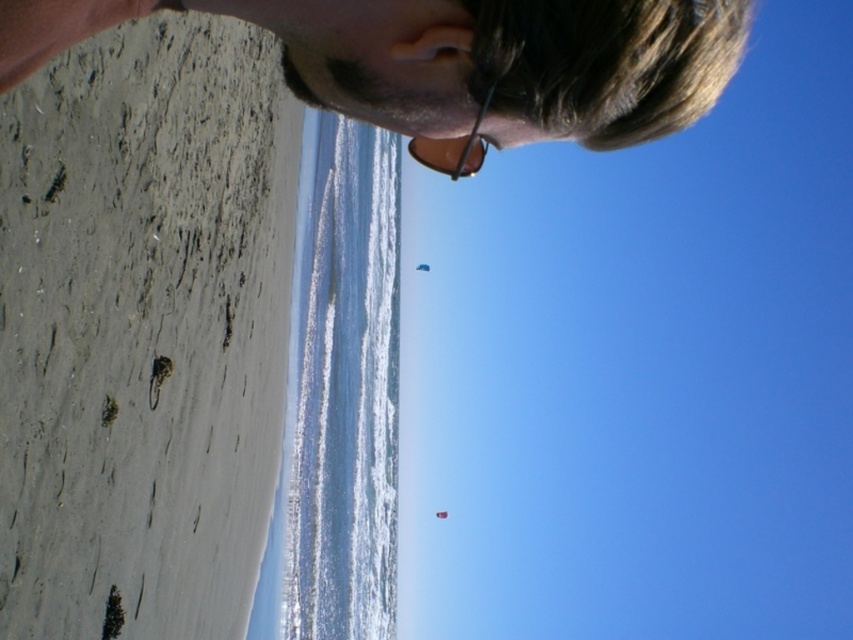
Who is positioned more to the right, sunglasses at upper center or blue fabric kite at center?

sunglasses at upper center

Which is below, sunglasses at upper center or blue fabric kite at center?

sunglasses at upper center

Find the location of `sunglasses at upper center`. sunglasses at upper center is located at coordinates (454, 147).

I want to click on sunglasses at upper center, so click(x=454, y=147).

Is smooth sand at lower left to the right of red fabric kite at upper center from the viewer's perspective?

Incorrect, smooth sand at lower left is not on the right side of red fabric kite at upper center.

Between smooth sand at lower left and red fabric kite at upper center, which one is positioned higher?

smooth sand at lower left

This screenshot has height=640, width=853. Identify the location of smooth sand at lower left. click(x=143, y=328).

Looking at this image, who is positioned more to the right, smooth sand at lower left or blue fabric kite at center?

Positioned to the right is smooth sand at lower left.

Does smooth sand at lower left have a larger size compared to blue fabric kite at center?

Indeed, smooth sand at lower left has a larger size compared to blue fabric kite at center.

Which is behind, point (244, 609) or point (422, 269)?

The point (422, 269) is behind.

You are a GUI agent. You are given a task and a screenshot of the screen. Output one action in this format:
    pyautogui.click(x=<x>, y=<y>)
    Task: Click on the smooth sand at lower left
    
    Given the screenshot: What is the action you would take?
    pyautogui.click(x=143, y=328)